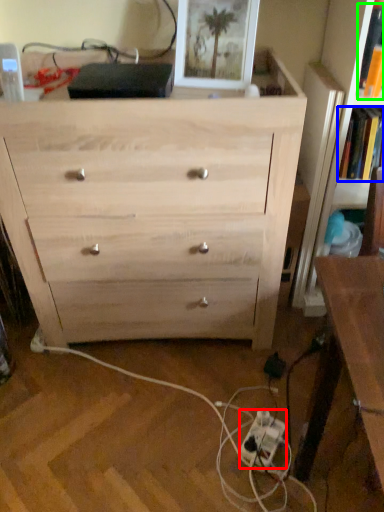
Question: Which object is positioned farthest from extension cord (highlighted by a red box)? Select from book (highlighted by a blue box) and book (highlighted by a green box).

Choices:
 (A) book
 (B) book

Answer: (B)